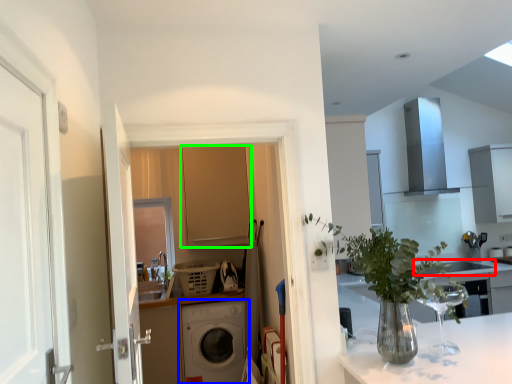
Question: Which object is positioned farthest from sink (highlighted by a red box)? Select from washing machine (highlighted by a blue box) and cabinetry (highlighted by a green box).

Choices:
 (A) washing machine
 (B) cabinetry

Answer: (B)